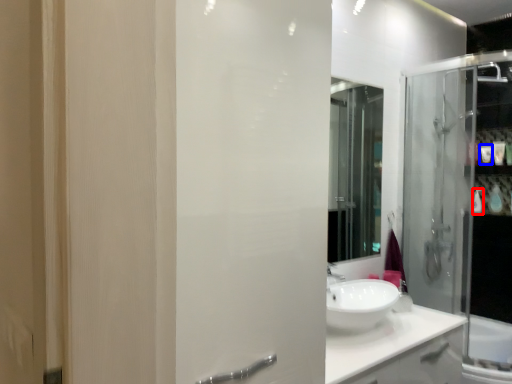
Question: Which point is further to the camera, toiletry (highlighted by a red box) or toiletry (highlighted by a blue box)?

Choices:
 (A) toiletry
 (B) toiletry

Answer: (A)